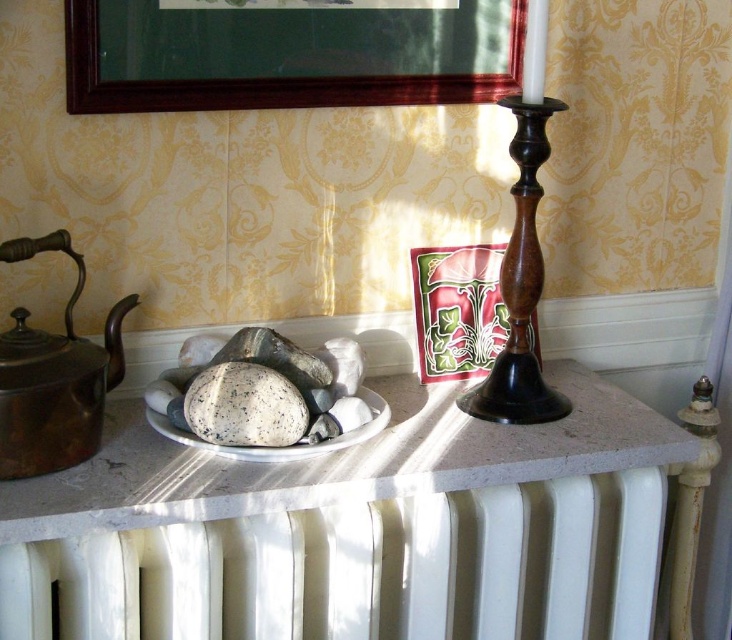
Question: Does white painted radiator at lower center come behind shiny brass teapot at left?

Choices:
 (A) yes
 (B) no

Answer: (B)

Question: Is white marble table at center smaller than speckled marble stone at center?

Choices:
 (A) no
 (B) yes

Answer: (A)

Question: Is white painted radiator at lower center thinner than white marble table at center?

Choices:
 (A) yes
 (B) no

Answer: (A)

Question: Based on their relative distances, which object is nearer to the white marble table at center?

Choices:
 (A) white painted radiator at lower center
 (B) speckled marble stone at center
 (C) dark wood picture frame at upper center
 (D) speckled stone plate at center

Answer: (A)

Question: Which of these objects is positioned closest to the speckled marble stone at center?

Choices:
 (A) white painted radiator at lower center
 (B) white marble table at center

Answer: (B)

Question: Considering the real-world distances, which object is closest to the wooden candlestick at center?

Choices:
 (A) white painted radiator at lower center
 (B) dark wood picture frame at upper center
 (C) speckled marble stone at center
 (D) speckled stone plate at center

Answer: (D)